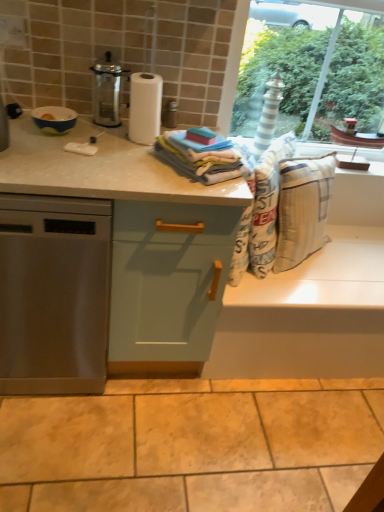
Question: Is beige cotton laundry at center thinner than beige marble granite at lower center?

Choices:
 (A) yes
 (B) no

Answer: (A)

Question: Is beige cotton laundry at center positioned in front of beige marble granite at lower center?

Choices:
 (A) yes
 (B) no

Answer: (B)

Question: Can you confirm if beige cotton laundry at center is shorter than beige marble granite at lower center?

Choices:
 (A) no
 (B) yes

Answer: (A)

Question: Does beige cotton laundry at center appear on the left side of beige marble granite at lower center?

Choices:
 (A) no
 (B) yes

Answer: (A)

Question: Could you tell me if beige cotton laundry at center is facing beige marble granite at lower center?

Choices:
 (A) no
 (B) yes

Answer: (A)

Question: Is beige cotton laundry at center oriented away from beige marble granite at lower center?

Choices:
 (A) no
 (B) yes

Answer: (A)

Question: Is beige marble granite at lower center to the right of soft cotton towels at center from the viewer's perspective?

Choices:
 (A) no
 (B) yes

Answer: (B)

Question: Does beige marble granite at lower center have a larger size compared to soft cotton towels at center?

Choices:
 (A) no
 (B) yes

Answer: (B)

Question: Is beige marble granite at lower center not within soft cotton towels at center?

Choices:
 (A) no
 (B) yes

Answer: (B)

Question: Does beige marble granite at lower center contain soft cotton towels at center?

Choices:
 (A) yes
 (B) no

Answer: (B)

Question: Does beige marble granite at lower center have a lesser height compared to soft cotton towels at center?

Choices:
 (A) no
 (B) yes

Answer: (A)

Question: Is the position of beige marble granite at lower center less distant than that of soft cotton towels at center?

Choices:
 (A) no
 (B) yes

Answer: (B)

Question: Is stainless steel dishwasher at left located within metallic glass carafe at upper left?

Choices:
 (A) no
 (B) yes

Answer: (A)